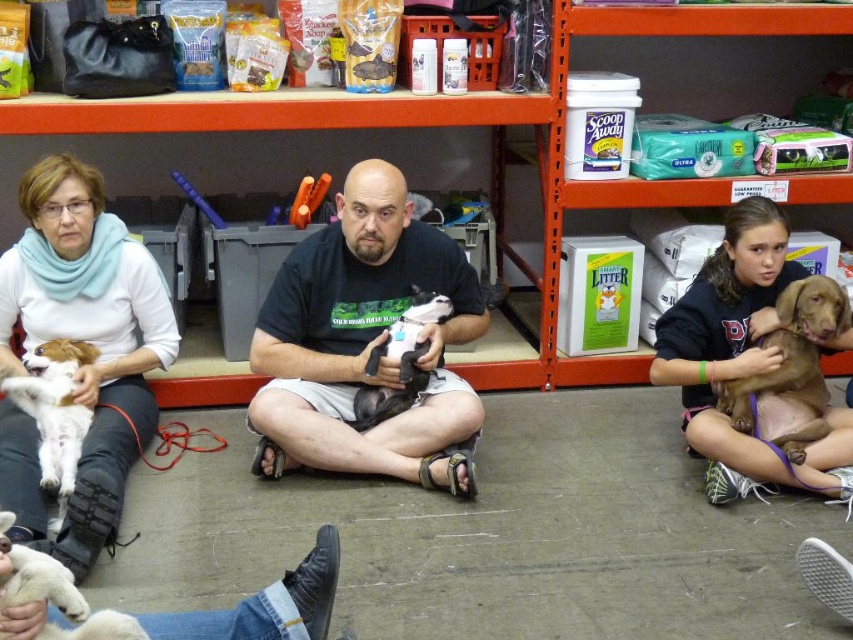
Question: Does white soft scarf at upper left have a lesser width compared to white fluffy dog at lower left?

Choices:
 (A) yes
 (B) no

Answer: (B)

Question: Which object appears closest to the camera in this image?

Choices:
 (A) brown furry dog at center right
 (B) black cotton shirt at center
 (C) white soft scarf at upper left

Answer: (C)

Question: Which point is farther to the camera?

Choices:
 (A) (427, 308)
 (B) (759, 344)

Answer: (A)

Question: Which object appears farthest from the camera in this image?

Choices:
 (A) white fur dog at left
 (B) white fluffy dog at lower left
 (C) white soft scarf at upper left
 (D) brown furry dog at center right

Answer: (D)

Question: Observing the image, what is the correct spatial positioning of brown fur dog at right in reference to black soft fabric dog at center?

Choices:
 (A) above
 (B) below

Answer: (A)

Question: Does white soft scarf at upper left have a lesser width compared to brown furry dog at center right?

Choices:
 (A) no
 (B) yes

Answer: (A)